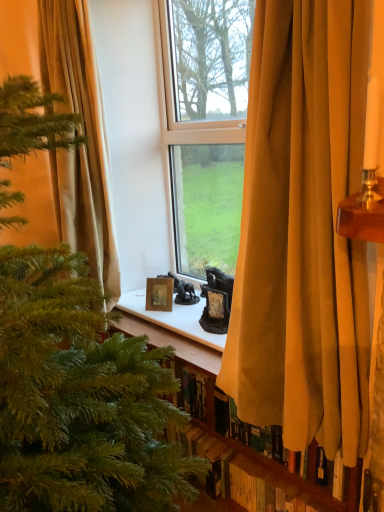
Question: Is the surface of velvet gold curtain at center, positioned as the second curtain in back-to-front order, in direct contact with green matte christmas tree at left?

Choices:
 (A) yes
 (B) no

Answer: (B)

Question: Does velvet gold curtain at center, positioned as the second curtain in back-to-front order, appear on the right side of green matte christmas tree at left?

Choices:
 (A) no
 (B) yes

Answer: (B)

Question: Can you confirm if velvet gold curtain at center, which ranks as the 1th curtain in front-to-back order, is smaller than green matte christmas tree at left?

Choices:
 (A) no
 (B) yes

Answer: (B)

Question: Is velvet gold curtain at center, the first curtain when ordered from right to left, positioned with its back to green matte christmas tree at left?

Choices:
 (A) yes
 (B) no

Answer: (B)

Question: Considering the relative sizes of velvet gold curtain at center, the first curtain when ordered from right to left, and green matte christmas tree at left in the image provided, is velvet gold curtain at center, the first curtain when ordered from right to left, wider than green matte christmas tree at left?

Choices:
 (A) yes
 (B) no

Answer: (B)

Question: Is velvet gold curtain at center, which ranks as the 1th curtain in front-to-back order, situated inside wooden photo frame at center or outside?

Choices:
 (A) inside
 (B) outside

Answer: (B)

Question: Relative to wooden photo frame at center, is velvet gold curtain at center, which ranks as the 1th curtain in front-to-back order, in front or behind?

Choices:
 (A) behind
 (B) front

Answer: (B)

Question: From the image's perspective, relative to wooden photo frame at center, is velvet gold curtain at center, the first curtain when ordered from right to left, above or below?

Choices:
 (A) above
 (B) below

Answer: (A)

Question: Based on their positions, is velvet gold curtain at center, which ranks as the 1th curtain in front-to-back order, located to the left or right of wooden photo frame at center?

Choices:
 (A) left
 (B) right

Answer: (B)

Question: Is wooden photo frame at center wider or thinner than velvet gold curtain at center, which ranks as the 1th curtain in front-to-back order?

Choices:
 (A) wide
 (B) thin

Answer: (B)

Question: Considering their positions, is wooden photo frame at center located in front of or behind velvet gold curtain at center, which ranks as the 1th curtain in front-to-back order?

Choices:
 (A) behind
 (B) front

Answer: (A)

Question: Considering the positions of wooden photo frame at center and velvet gold curtain at center, which is counted as the 2th curtain, starting from the left, in the image, is wooden photo frame at center bigger or smaller than velvet gold curtain at center, which is counted as the 2th curtain, starting from the left,?

Choices:
 (A) small
 (B) big

Answer: (A)

Question: Visually, is wooden photo frame at center positioned to the left or to the right of velvet gold curtain at center, positioned as the second curtain in back-to-front order?

Choices:
 (A) left
 (B) right

Answer: (A)

Question: In the image, is green matte christmas tree at left positioned in front of or behind beige fabric curtain at left, the first curtain when ordered from left to right?

Choices:
 (A) front
 (B) behind

Answer: (A)

Question: In terms of width, does green matte christmas tree at left look wider or thinner when compared to beige fabric curtain at left, the first curtain when ordered from left to right?

Choices:
 (A) thin
 (B) wide

Answer: (B)